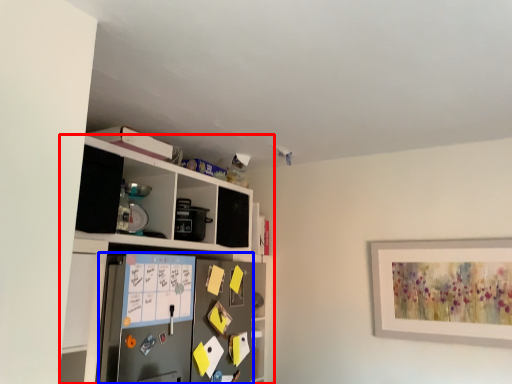
Question: Which point is closer to the camera, shelf (highlighted by a red box) or appliance (highlighted by a blue box)?

Choices:
 (A) shelf
 (B) appliance

Answer: (A)